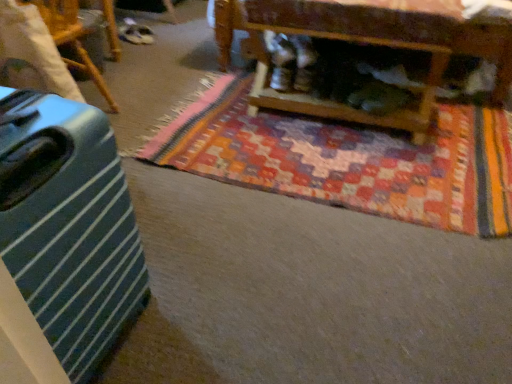
Question: Which direction should I rotate to face wooden coffee table at upper center, the first furniture when ordered from right to left, — up or down?

Choices:
 (A) down
 (B) up

Answer: (B)

Question: Is green striped suitcase at left completely or partially outside of green striped suitcase at left, which appears as the first furniture when viewed from the left?

Choices:
 (A) yes
 (B) no

Answer: (A)

Question: From the image's perspective, would you say green striped suitcase at left is positioned over green striped suitcase at left, arranged as the second furniture when viewed from the right?

Choices:
 (A) yes
 (B) no

Answer: (B)

Question: From a real-world perspective, is green striped suitcase at left located higher than green striped suitcase at left, arranged as the second furniture when viewed from the right?

Choices:
 (A) no
 (B) yes

Answer: (A)

Question: Does green striped suitcase at left turn towards green striped suitcase at left, arranged as the second furniture when viewed from the right?

Choices:
 (A) yes
 (B) no

Answer: (B)

Question: Would you consider green striped suitcase at left to be distant from green striped suitcase at left, arranged as the second furniture when viewed from the right?

Choices:
 (A) no
 (B) yes

Answer: (B)

Question: Is green striped suitcase at left taller than green striped suitcase at left, which appears as the first furniture when viewed from the left?

Choices:
 (A) yes
 (B) no

Answer: (A)

Question: Can you confirm if green striped suitcase at left, arranged as the second furniture when viewed from the right, is smaller than wooden coffee table at upper center, the 2th furniture when ordered from left to right?

Choices:
 (A) no
 (B) yes

Answer: (B)

Question: Can you confirm if green striped suitcase at left, which appears as the first furniture when viewed from the left, is shorter than wooden coffee table at upper center, the first furniture when ordered from right to left?

Choices:
 (A) yes
 (B) no

Answer: (A)

Question: Does green striped suitcase at left, arranged as the second furniture when viewed from the right, have a greater height compared to wooden coffee table at upper center, the first furniture when ordered from right to left?

Choices:
 (A) no
 (B) yes

Answer: (A)

Question: Does green striped suitcase at left, arranged as the second furniture when viewed from the right, come in front of wooden coffee table at upper center, the first furniture when ordered from right to left?

Choices:
 (A) no
 (B) yes

Answer: (B)

Question: From the image's perspective, does green striped suitcase at left, arranged as the second furniture when viewed from the right, appear lower than wooden coffee table at upper center, the first furniture when ordered from right to left?

Choices:
 (A) no
 (B) yes

Answer: (B)

Question: Are green striped suitcase at left, arranged as the second furniture when viewed from the right, and wooden coffee table at upper center, the first furniture when ordered from right to left, far apart?

Choices:
 (A) yes
 (B) no

Answer: (B)

Question: Is green striped suitcase at left, which appears as the first furniture when viewed from the left, shorter than green striped suitcase at left?

Choices:
 (A) no
 (B) yes

Answer: (B)